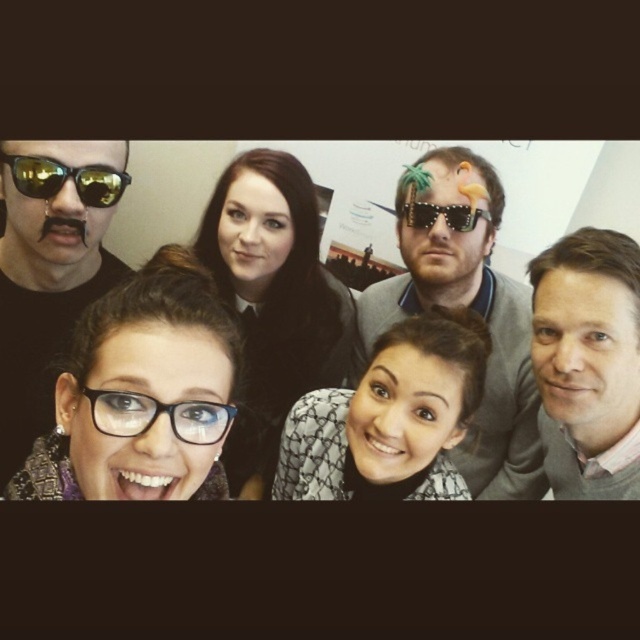
Question: Is the position of sunglasses at upper center less distant than that of gold reflective sunglasses at upper left?

Choices:
 (A) no
 (B) yes

Answer: (A)

Question: Which of these objects is positioned farthest from the gray sweater at upper right?

Choices:
 (A) black textured glasses at lower left
 (B) black matte sunglasses at upper left
 (C) shiny metallic sunglasses at center
 (D) black plastic glasses at lower left

Answer: (B)

Question: Which object is farther from the camera taking this photo?

Choices:
 (A) gray sweater at upper right
 (B) black textured glasses at lower left

Answer: (A)

Question: Among these objects, which one is nearest to the camera?

Choices:
 (A) shiny metallic sunglasses at center
 (B) patterned fabric hair at center
 (C) black plastic glasses at lower left
 (D) gold reflective sunglasses at upper left

Answer: (C)

Question: Is gold reflective sunglasses at upper left closer to the viewer compared to shiny metallic sunglasses at center?

Choices:
 (A) yes
 (B) no

Answer: (A)

Question: Can you confirm if sunglasses at upper center is smaller than gray sweater at upper right?

Choices:
 (A) yes
 (B) no

Answer: (B)